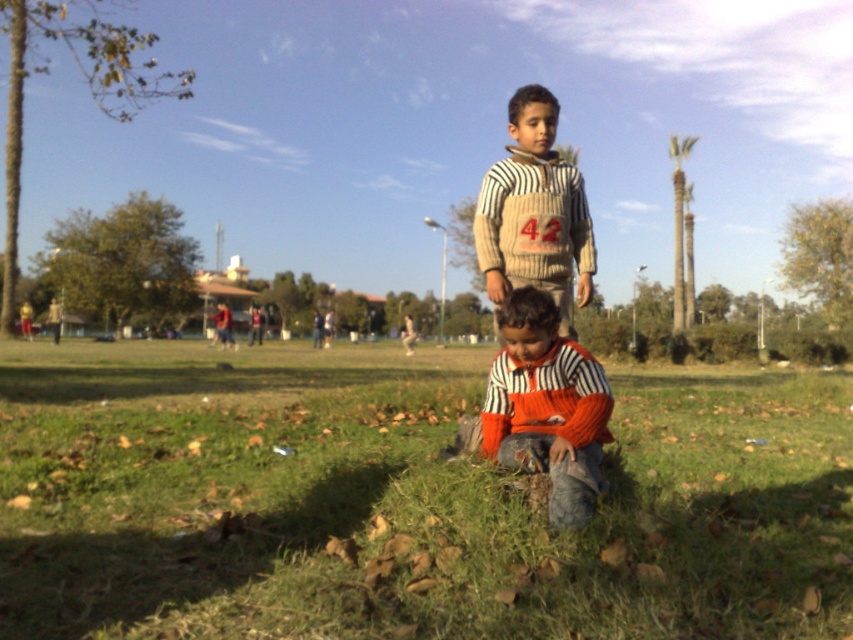
Is striped wool sweater at center below striped sweater at center?

Yes.

Is striped wool sweater at center thinner than striped sweater at center?

No.

Locate an element on the screen. The image size is (853, 640). striped wool sweater at center is located at coordinates (546, 406).

Is green grass at center to the left of striped sweater at center from the viewer's perspective?

Yes, green grass at center is to the left of striped sweater at center.

Between green grass at center and striped sweater at center, which one is positioned higher?

striped sweater at center is above.

Locate an element on the screen. The height and width of the screenshot is (640, 853). green grass at center is located at coordinates (404, 500).

Does green grass at center appear over striped wool sweater at center?

Incorrect, green grass at center is not positioned above striped wool sweater at center.

Based on the photo, who is shorter, green grass at center or striped wool sweater at center?

green grass at center is shorter.

Does point (708, 532) come farther from viewer compared to point (560, 513)?

Yes, point (708, 532) is farther from viewer.

Where is `green grass at center`? green grass at center is located at coordinates (404, 500).